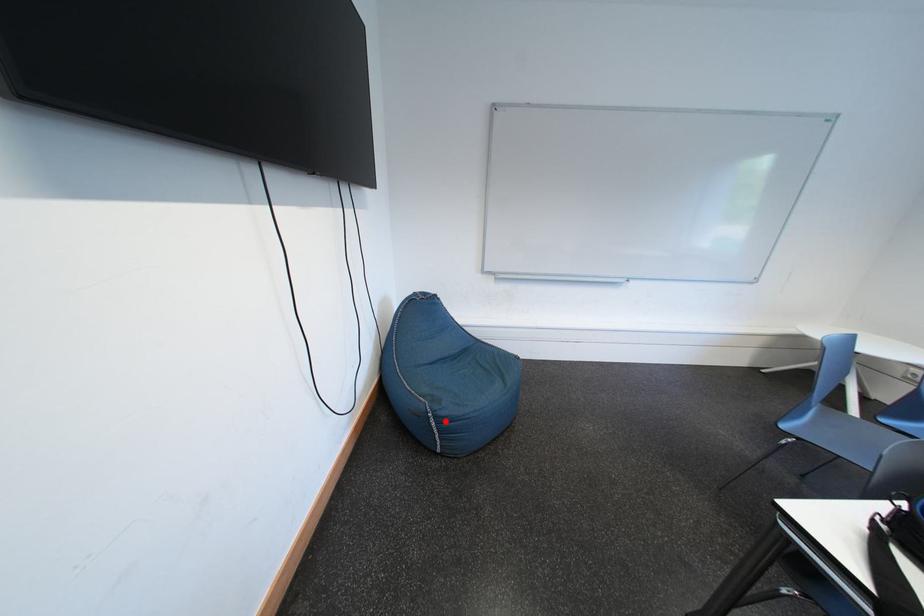
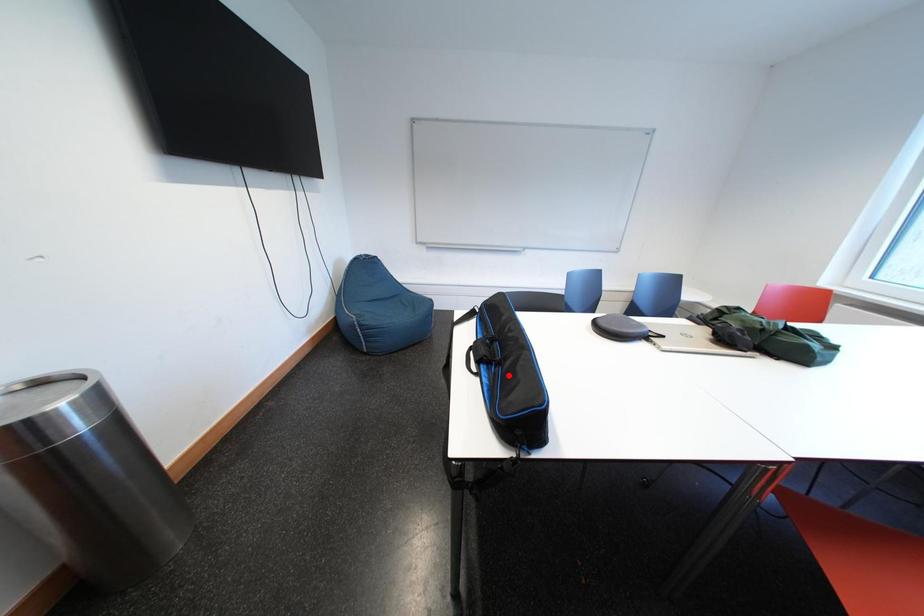
I am providing you with two images of the same scene from different viewpoints. A red point is marked on the first image and another point is marked on the second image. Does the point marked in image1 correspond to the same location as the one in image2?

No